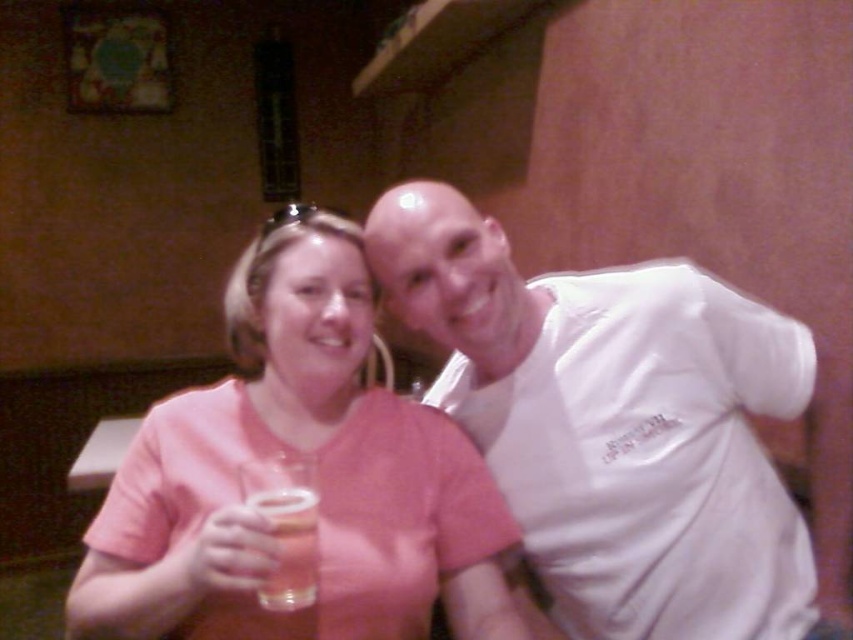
From the picture: You are standing at the position of the camera and want to take a photo of both the point at (120,506) and the point at (276,602). Which point should you focus on first to ensure both are in focus?

You should focus on the point at (276,602) first because it is closer to the camera than the point at (120,506), which is behind it. This ensures both points are within the depth of field.

You are a photographer taking a picture of the pink matte shirt at center and the translucent glass beer at center. Which object will appear closer to the camera in the photo?

The pink matte shirt at center appears closer to the camera because it is in front of the translucent glass beer at center.